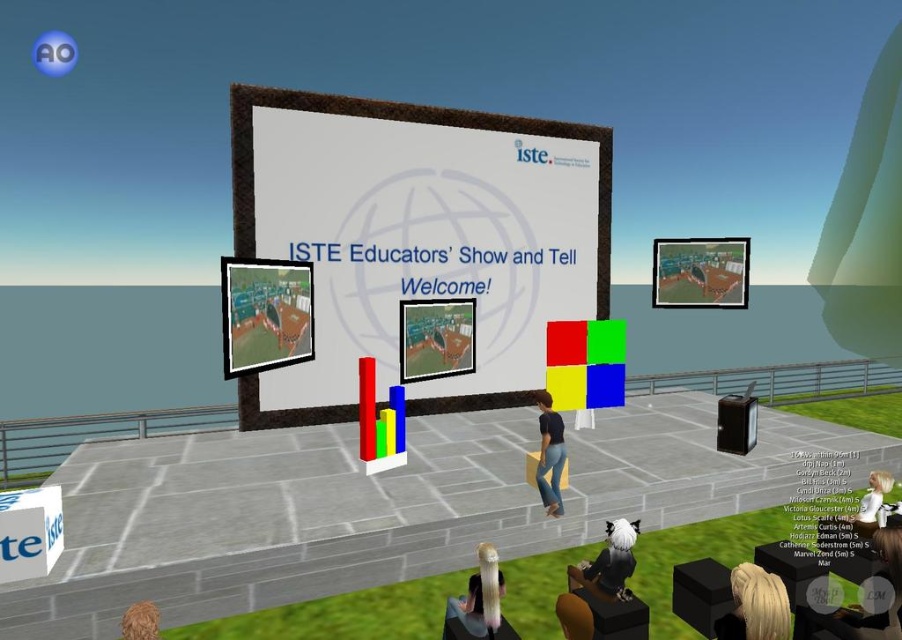
You are an attendee at the ISTE Educators Show and Tell event. You want to find the white paper at center. According to the coordinates provided, where should you look to find it?

The white paper at center is located at the coordinates point (417, 240).

You are an attendee at the ISTE Educators Show and Tell event. You see a person with black hair at lower center and a green plastic chair at lower right. Which object is wider?

The black hair at lower center might be wider than green plastic chair at lower right.